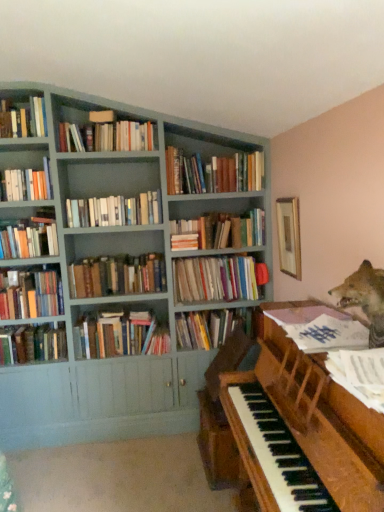
At what (x,y) coordinates should I click in order to perform the action: click on free space above white paper music at right, arranged as the eleventh book when viewed from the top (from a real-world perspective). Please return your answer as a coordinate pair (x, y). This screenshot has width=384, height=512. Looking at the image, I should click on (328, 323).